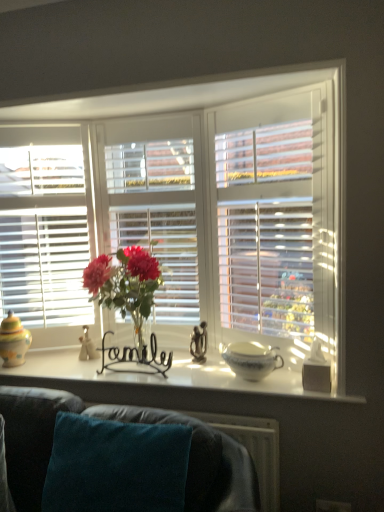
This screenshot has height=512, width=384. I want to click on vacant space that is in between translucent glass vase at center and multicolored ceramic jar at left, which ranks as the third candle holder in right-to-left order, so click(x=67, y=368).